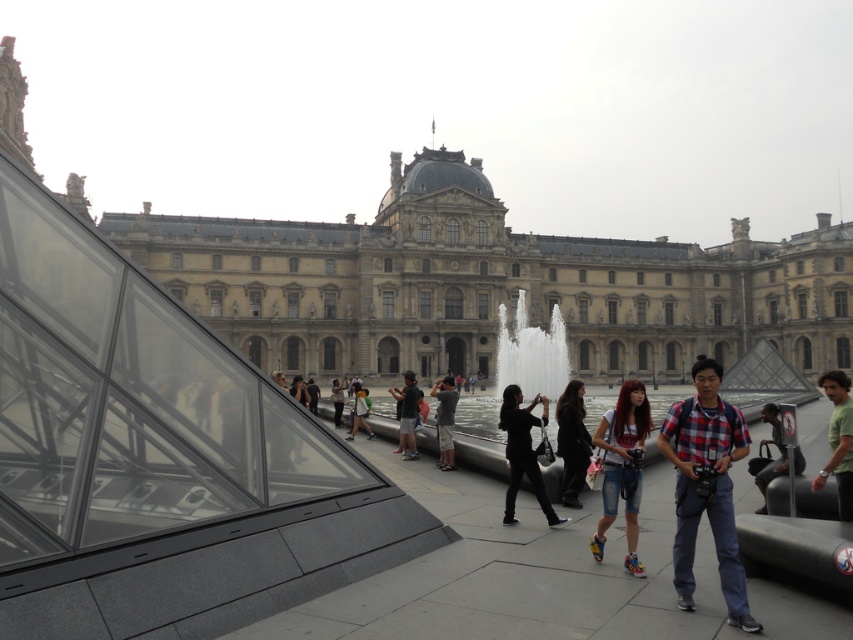
You are standing in front of the Louvre Museum and see a plaid shirt at center and a black fabric jacket at center. Which one is positioned more to the right?

The plaid shirt at center is positioned to the right of the black fabric jacket at center, so the plaid shirt at center is more to the right.

You are standing at the entrance of the Louvre Museum and see a white marble fountain at center. Can you confirm if the fountain is located at point [531,353]?

Yes, the white marble fountain at center is located at point [531,353].